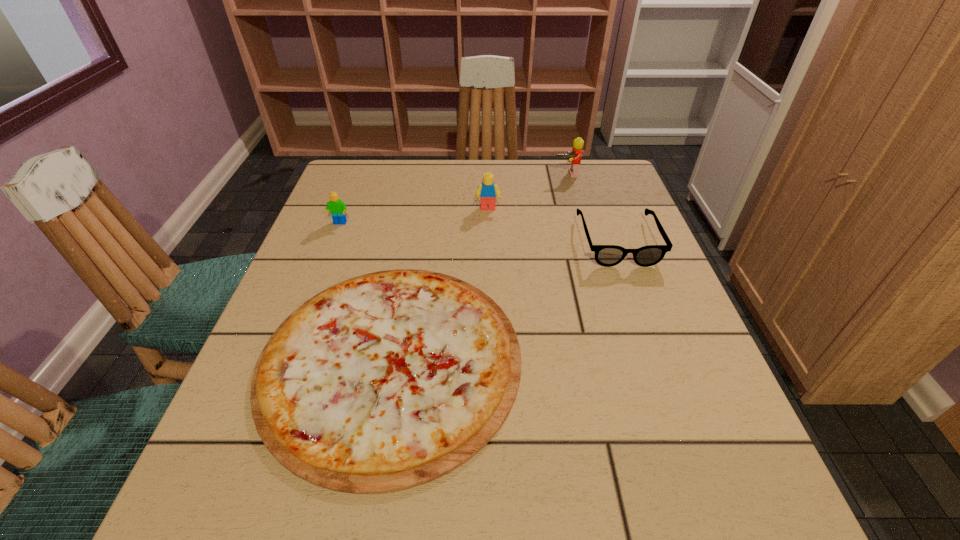
Locate an element on the screen. The width and height of the screenshot is (960, 540). the farthest object is located at coordinates (574, 157).

Where is `the farthest Lego`? the farthest Lego is located at coordinates (574, 157).

Find the location of a particular element. The height and width of the screenshot is (540, 960). the second farthest object is located at coordinates (488, 191).

In order to click on the second nearest Lego in this screenshot , I will do pos(488,191).

What are the coordinates of `the shortest Lego` in the screenshot? It's located at (337, 207).

Locate an element on the screen. the third shortest object is located at coordinates (337, 207).

I want to click on the fourth tallest object, so click(605, 255).

Locate an element on the screen. the nearest object is located at coordinates click(x=386, y=381).

At what (x,y) coordinates should I click in order to perform the action: click on pizza. Please return your answer as a coordinate pair (x, y). This screenshot has height=540, width=960. Looking at the image, I should click on [386, 381].

What are the coordinates of `blank area located in front of the farthest object with the accessory visible` in the screenshot? It's located at (591, 262).